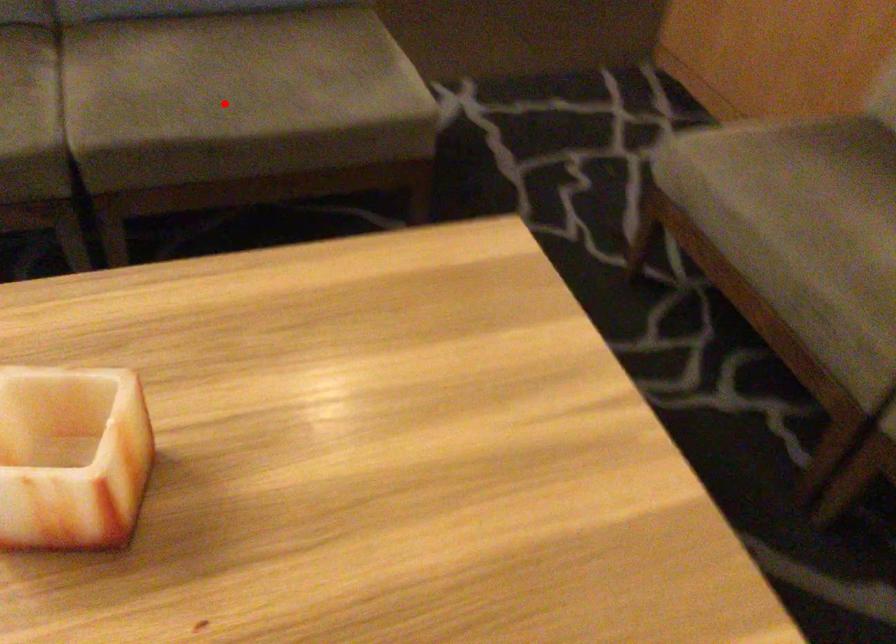
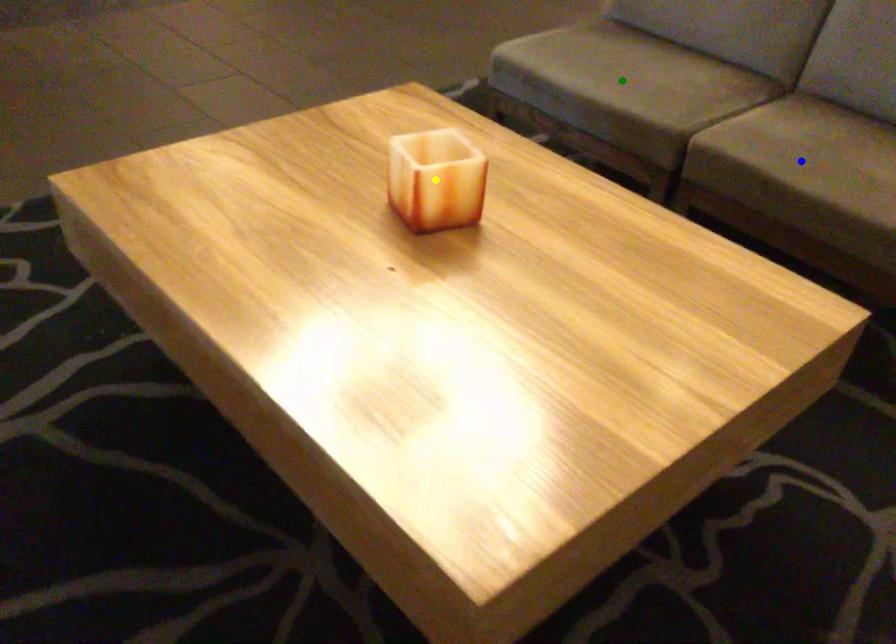
Question: I am providing you with two images of the same scene from different viewpoints. A red point is marked on the first image. You are given multiple points on the second image. Which point in image 2 represents the same 3d spot as the red point in image 1?

Choices:
 (A) blue point
 (B) yellow point
 (C) green point

Answer: (A)